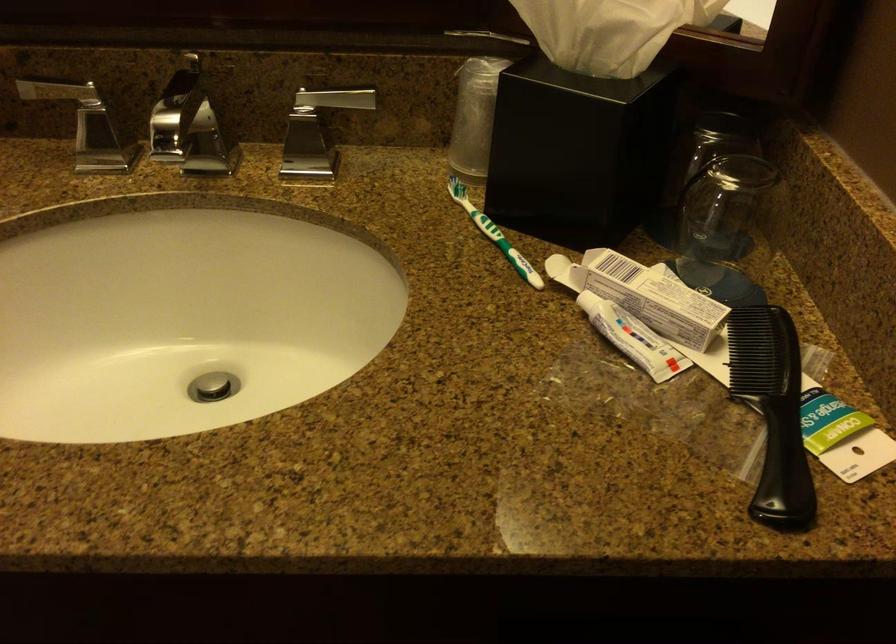
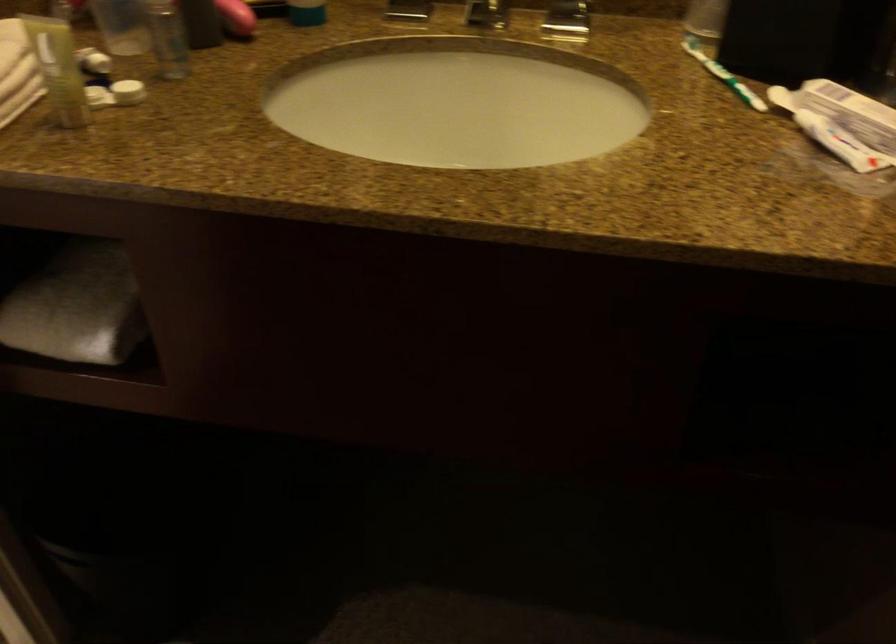
Question: The camera is either moving clockwise (left) or counter-clockwise (right) around the object. The first image is from the beginning of the video and the second image is from the end. Is the camera moving left or right when shooting the video?

Choices:
 (A) Left
 (B) Right

Answer: (B)